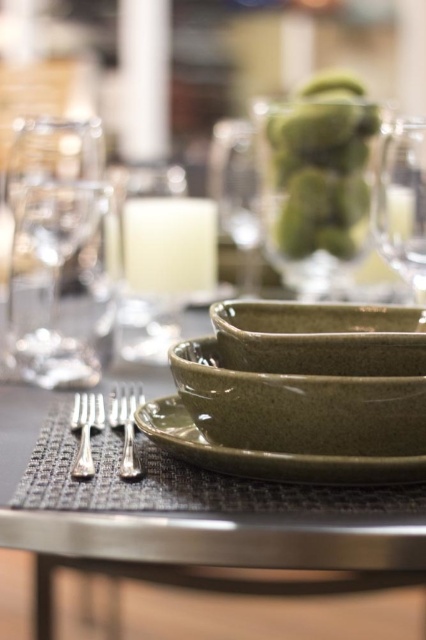
Is clear crystal wine glass at left to the left of green speckled plate at center from the viewer's perspective?

Yes, clear crystal wine glass at left is to the left of green speckled plate at center.

Which is above, clear crystal wine glass at left or green speckled plate at center?

clear crystal wine glass at left

Is point (43, 195) positioned behind point (411, 477)?

Yes, it is.

Locate an element on the screen. This screenshot has width=426, height=640. clear crystal wine glass at left is located at coordinates (55, 250).

Based on the photo, does green speckled bowl at center appear on the right side of green stoneware bowl at center?

Incorrect, green speckled bowl at center is not on the right side of green stoneware bowl at center.

Between green speckled bowl at center and green stoneware bowl at center, which one is positioned higher?

green stoneware bowl at center is above.

The height and width of the screenshot is (640, 426). I want to click on green speckled bowl at center, so click(299, 406).

At what (x,y) coordinates should I click in order to perform the action: click on green speckled bowl at center. Please return your answer as a coordinate pair (x, y). The width and height of the screenshot is (426, 640). Looking at the image, I should click on (299, 406).

Does clear glass wine glass at upper right have a greater height compared to clear glass wine glass at center?

In fact, clear glass wine glass at upper right may be shorter than clear glass wine glass at center.

Who is shorter, clear glass wine glass at upper right or clear glass wine glass at center?

clear glass wine glass at upper right

Which is in front, point (408, 205) or point (256, 209)?

Point (408, 205)

Identify the location of clear glass wine glass at upper right. (402, 202).